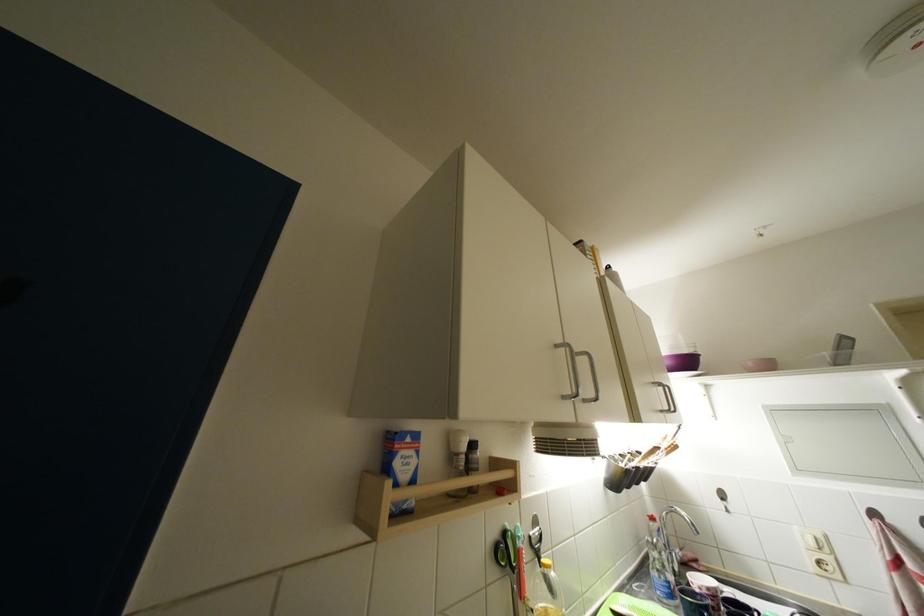
Where would you turn the faucet handle? Please return your answer as a coordinate pair (x, y).

(676, 554)